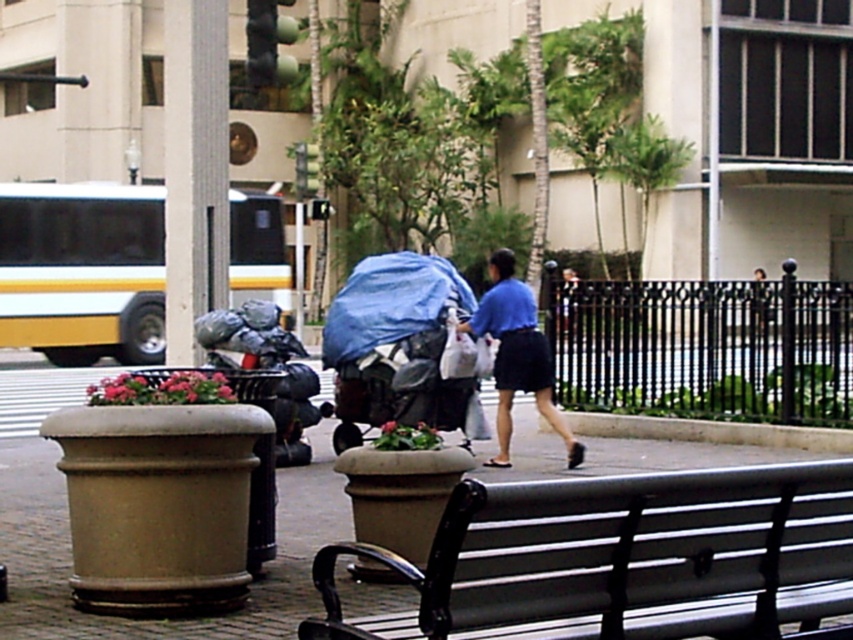
You are standing at the point labeled as point (x=68, y=532) in the urban street scene. What type of surface are you standing on?

The surface at point (x=68, y=532) is smooth concrete pavement at center.

Based on the photo, you are standing at the point marked by coordinates point (624, 560) in the urban street scene. What object are you likely standing on?

The metallic gray bench at lower center is represented by point (624, 560), so you are likely standing on the metallic gray bench at lower center.